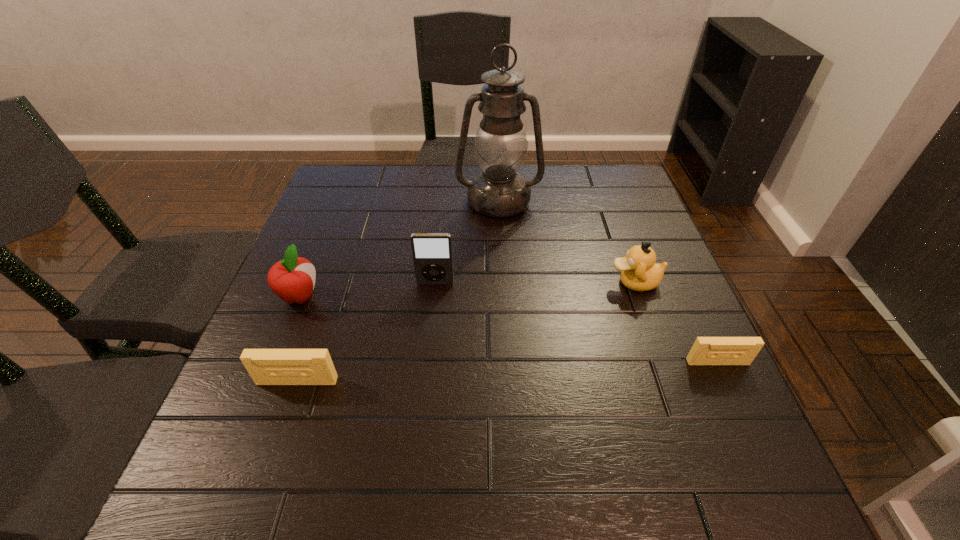
Find the location of `videotape at the right edge`. videotape at the right edge is located at coordinates (706, 350).

Find the location of `duckling at the right edge`. duckling at the right edge is located at coordinates (639, 272).

This screenshot has height=540, width=960. Identify the location of blank space at the far edge of the desktop. [557, 189].

In the image, there is a desktop. What are the coordinates of `vacant space at the left edge` in the screenshot? It's located at (340, 304).

In the image, there is a desktop. At what (x,y) coordinates should I click in order to perform the action: click on vacant space at the right edge. Please return your answer as a coordinate pair (x, y). The height and width of the screenshot is (540, 960). Looking at the image, I should click on (622, 287).

This screenshot has width=960, height=540. I want to click on vacant region at the far left corner, so click(x=364, y=197).

Find the location of `free space at the far right corner of the desktop`. free space at the far right corner of the desktop is located at coordinates (629, 194).

Locate an element on the screen. The height and width of the screenshot is (540, 960). free space between the tallest object and the shorter videotape is located at coordinates (609, 282).

The width and height of the screenshot is (960, 540). Find the location of `free spot between the second nearest object and the duckling`. free spot between the second nearest object and the duckling is located at coordinates (676, 322).

This screenshot has height=540, width=960. What are the coordinates of `vacant space that's between the duckling and the shorter videotape` in the screenshot? It's located at (676, 322).